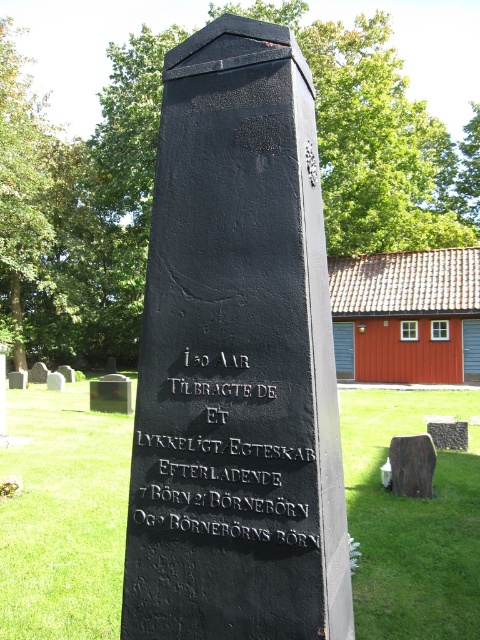
Does black stone monument at center have a greater height compared to brown wood at center?

Correct, black stone monument at center is much taller as brown wood at center.

Between black stone monument at center and brown wood at center, which one appears on the left side from the viewer's perspective?

Positioned to the left is black stone monument at center.

Who is more distant from viewer, [132,628] or [403,465]?

The point [403,465] is behind.

At what (x,y) coordinates should I click in order to perform the action: click on black stone monument at center. Please return your answer as a coordinate pair (x, y). The width and height of the screenshot is (480, 640). Looking at the image, I should click on (237, 358).

Can you confirm if brown wood at center is positioned to the left of black stone gravestone at center?

Indeed, brown wood at center is positioned on the left side of black stone gravestone at center.

Does brown wood at center lie behind black stone gravestone at center?

No, it is in front of black stone gravestone at center.

The height and width of the screenshot is (640, 480). What are the coordinates of `brown wood at center` in the screenshot? It's located at (411, 465).

Find the location of a particular element. This screenshot has width=480, height=640. brown wood at center is located at coordinates (411, 465).

From the picture: Between black stone monument at center and black stone gravestone at center, which one appears on the left side from the viewer's perspective?

black stone monument at center is more to the left.

Who is more forward, (184, 449) or (440, 444)?

Point (184, 449)

Where is `black stone monument at center`? black stone monument at center is located at coordinates (237, 358).